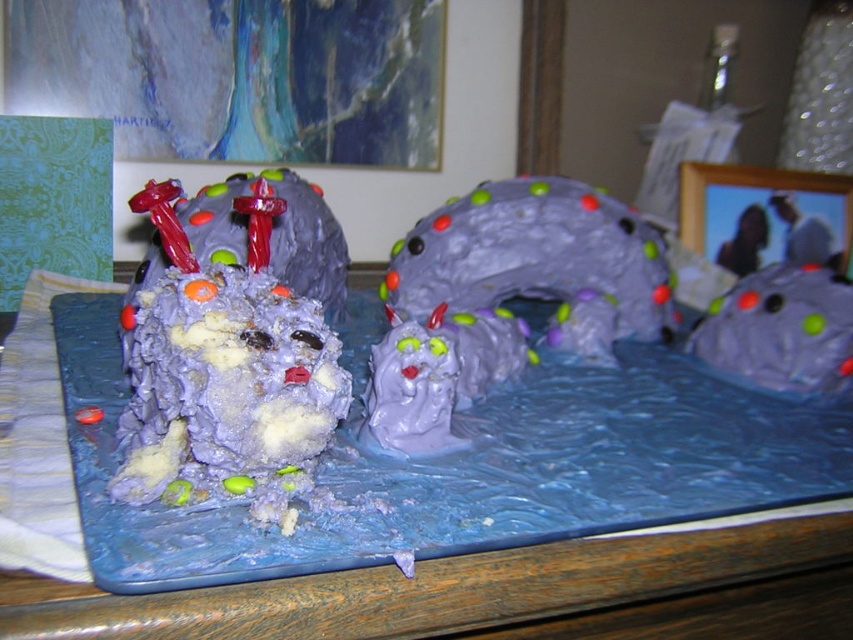
Question: Which object is closer to the camera taking this photo?

Choices:
 (A) purple frosted cake at left
 (B) blue fondant cake at center

Answer: (B)

Question: Is blue fondant cake at center positioned behind purple frosted cake at left?

Choices:
 (A) no
 (B) yes

Answer: (A)

Question: Which point is closer to the camera?

Choices:
 (A) purple frosted cake at left
 (B) blue fondant cake at center

Answer: (B)

Question: Does blue fondant cake at center have a larger size compared to purple frosted cake at left?

Choices:
 (A) yes
 (B) no

Answer: (A)

Question: Is blue fondant cake at center positioned before purple frosted cake at left?

Choices:
 (A) yes
 (B) no

Answer: (A)